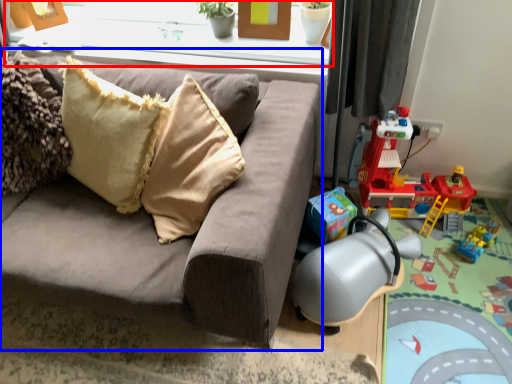
Question: Which object appears closest to the camera in this image, window frame (highlighted by a red box) or studio couch (highlighted by a blue box)?

Choices:
 (A) window frame
 (B) studio couch

Answer: (B)